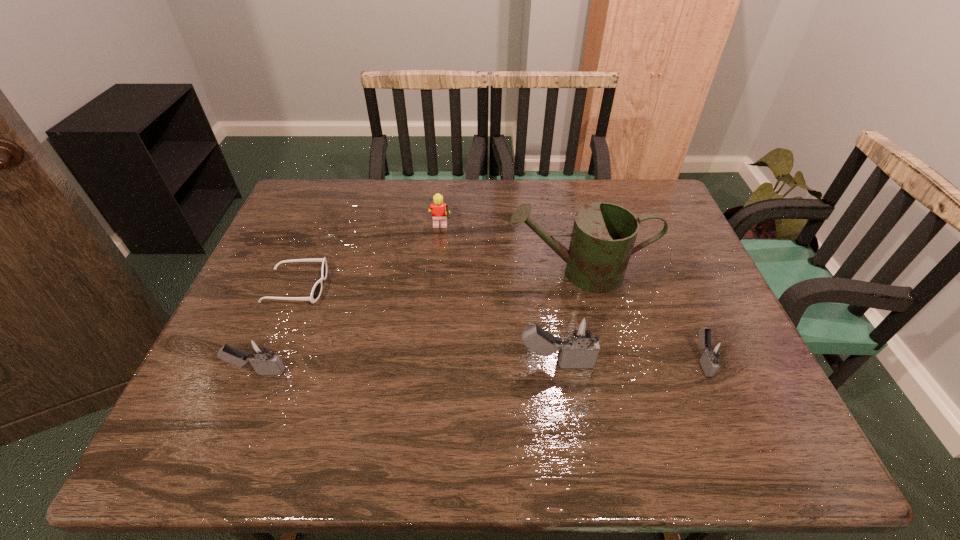
If we want them evenly spaced by inserting an extra igniter among them, please locate a free spot for this new igniter. Please provide its 2D coordinates. Your answer should be formatted as a tuple, i.e. [(x, y)], where the tuple contains the x and y coordinates of a point satisfying the conditions above.

[(408, 368)]